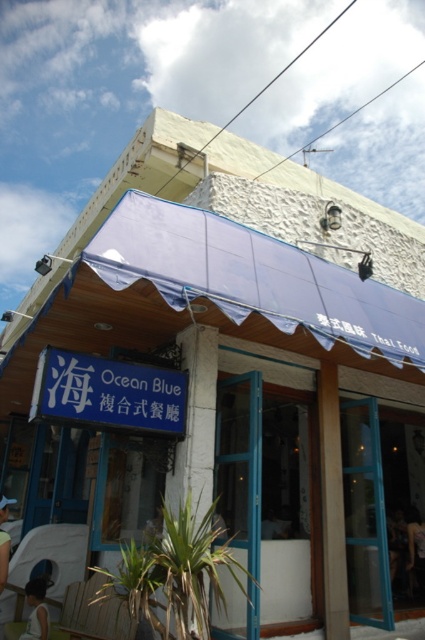
Is point (28, 620) positioned behind point (408, 532)?

That is False.

Is point (31, 609) positioned in front of point (422, 522)?

Yes, it is in front of point (422, 522).

What do you see at coordinates (36, 611) in the screenshot?
I see `light skin human at lower left` at bounding box center [36, 611].

This screenshot has width=425, height=640. In order to click on light skin human at lower left in this screenshot , I will do `click(36, 611)`.

Who is positioned more to the left, light skin human at lower left or light blue fabric at lower left?

light blue fabric at lower left

The height and width of the screenshot is (640, 425). I want to click on light skin human at lower left, so pyautogui.click(x=36, y=611).

Between point (87, 257) and point (44, 612), which one is positioned in front?

Point (87, 257) is in front.

Between point (127, 278) and point (37, 611), which one is positioned behind?

The point (37, 611) is behind.

Is point (204, 266) positioned behind point (36, 604)?

No, it is in front of (36, 604).

Where is `transparent fabric canopy at center`? This screenshot has width=425, height=640. transparent fabric canopy at center is located at coordinates (254, 278).